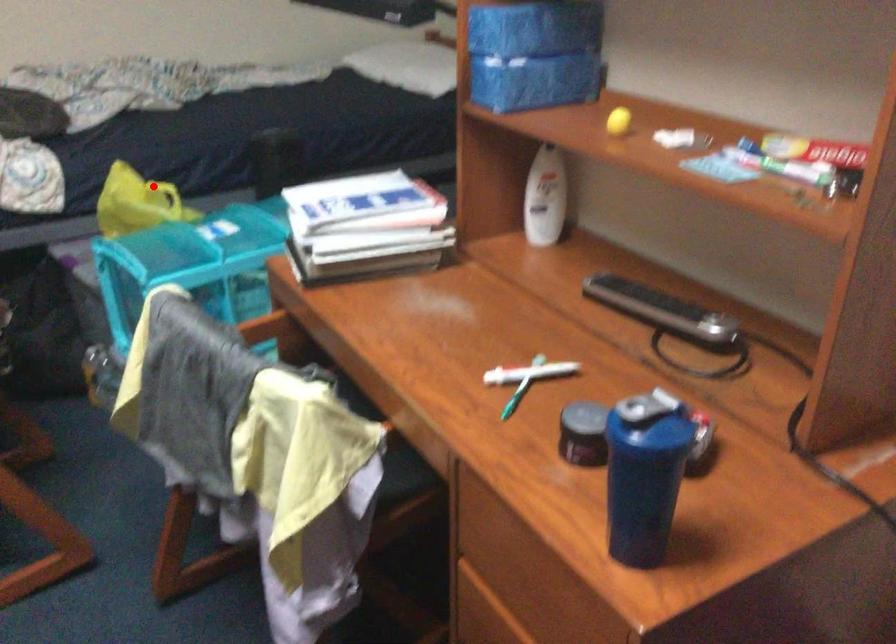
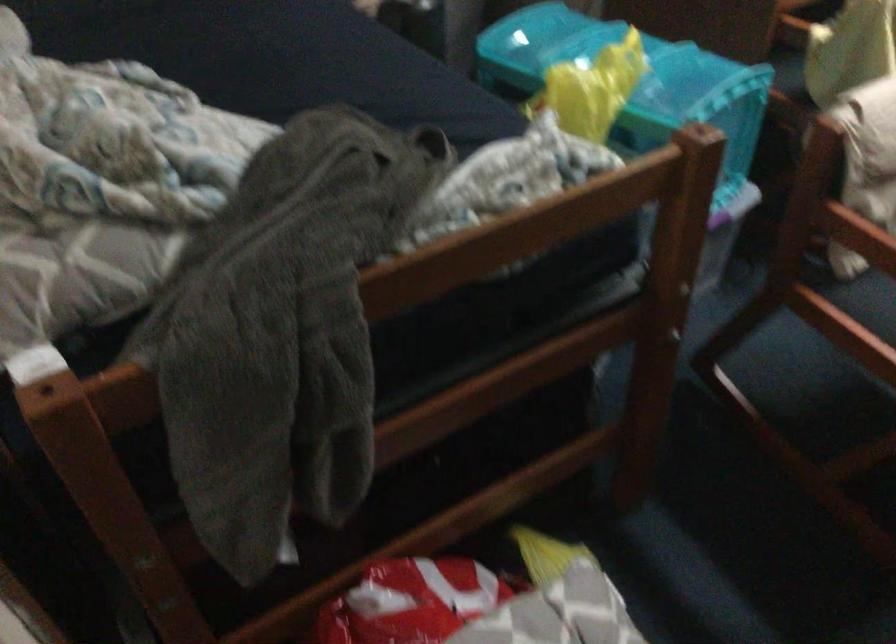
Locate, in the second image, the point that corresponds to the highlighted location in the first image.

(600, 62)